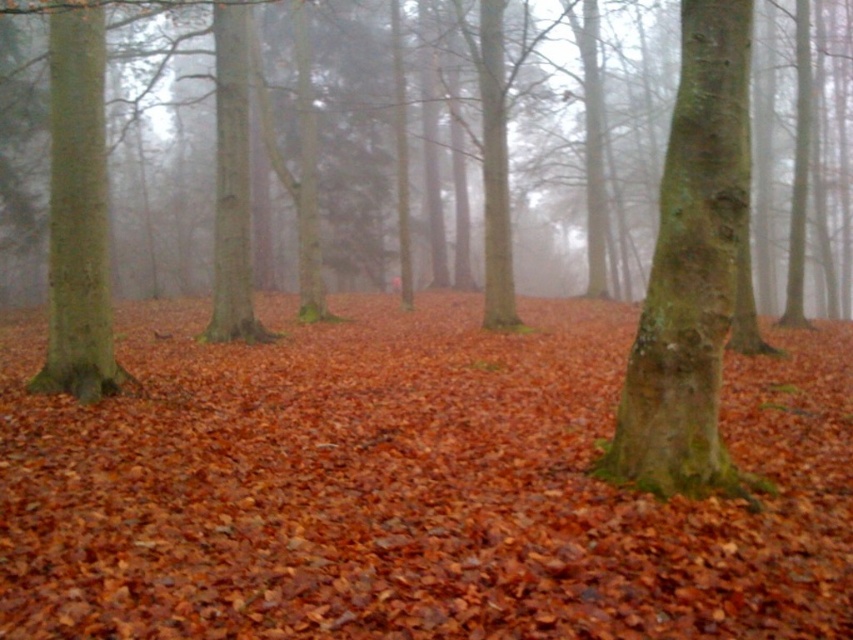
Question: Does leaves at center lie behind green rough bark tree at center?

Choices:
 (A) yes
 (B) no

Answer: (B)

Question: Which of the following is the farthest from the observer?

Choices:
 (A) (68, 564)
 (B) (660, 321)

Answer: (B)

Question: Does green rough bark tree at center appear on the right side of green rough bark tree at left?

Choices:
 (A) yes
 (B) no

Answer: (A)

Question: Estimate the real-world distances between objects in this image. Which object is closer to the green rough bark tree at center?

Choices:
 (A) leaves at center
 (B) green rough bark tree at left

Answer: (A)

Question: Does green rough bark tree at center have a lesser width compared to green rough bark tree at left?

Choices:
 (A) no
 (B) yes

Answer: (B)

Question: Which point is farther to the camera?

Choices:
 (A) (84, 76)
 (B) (724, 307)

Answer: (A)